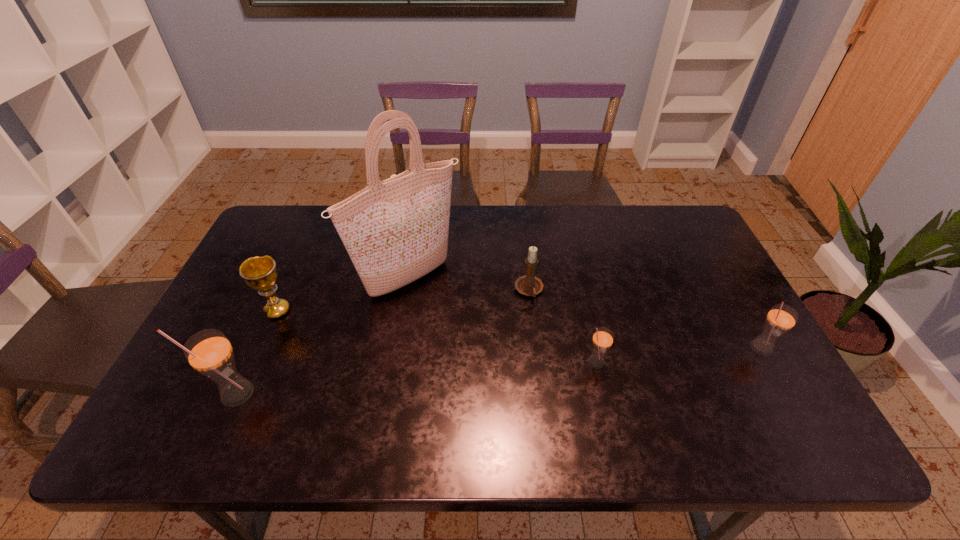
If equal spacing is desired by inserting an extra straw_(for_drinking) among them, please point out a free spot for this new straw_(for_drinking). Please provide its 2D coordinates. Your answer should be formatted as a tuple, i.e. [(x, y)], where the tuple contains the x and y coordinates of a point satisfying the conditions above.

[(420, 377)]